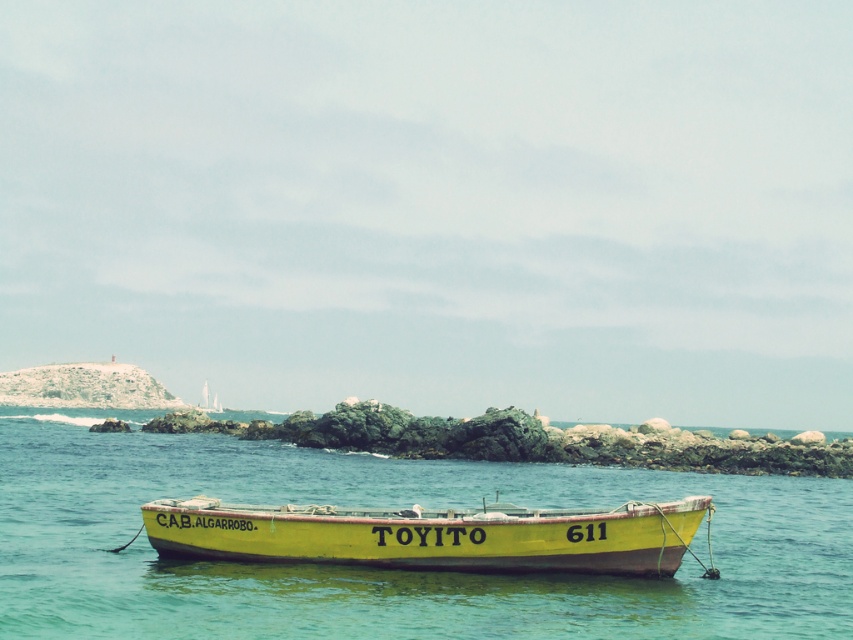
Question: Which point is farther to the camera?

Choices:
 (A) (245, 512)
 (B) (350, 608)

Answer: (A)

Question: Is turquoise water at center to the left of yellow matte boat at center from the viewer's perspective?

Choices:
 (A) no
 (B) yes

Answer: (B)

Question: Among these objects, which one is farthest from the camera?

Choices:
 (A) yellow matte boat at center
 (B) turquoise water at center

Answer: (A)

Question: Among these points, which one is farthest from the camera?

Choices:
 (A) (517, 628)
 (B) (583, 536)

Answer: (B)

Question: From the image, what is the correct spatial relationship of turquoise water at center in relation to yellow matte boat at center?

Choices:
 (A) above
 (B) below

Answer: (B)

Question: In this image, where is turquoise water at center located relative to yellow matte boat at center?

Choices:
 (A) left
 (B) right

Answer: (A)